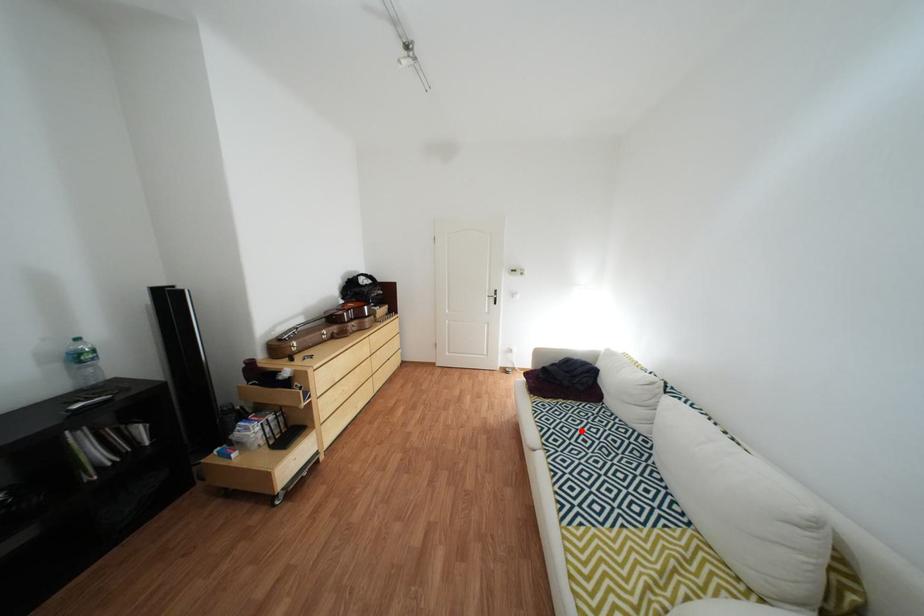
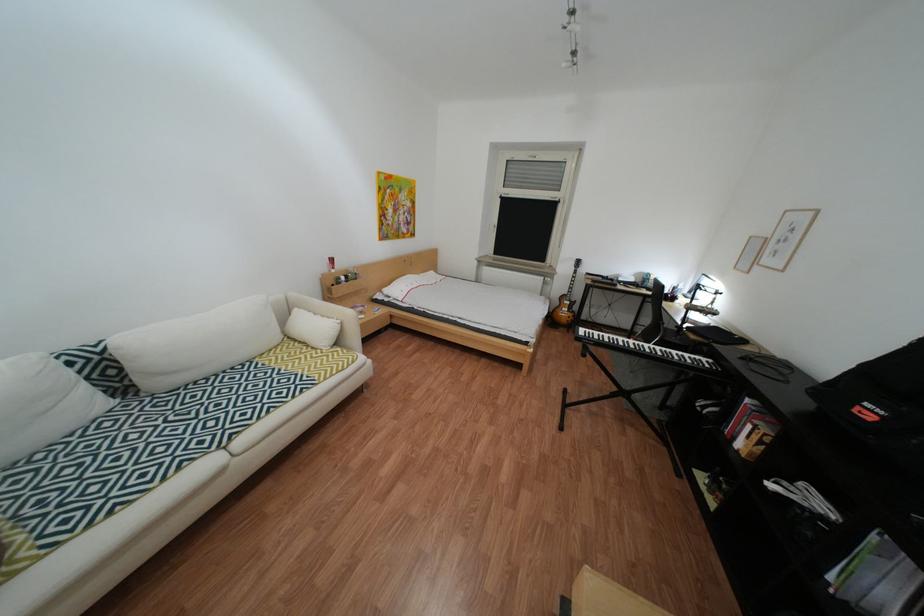
Where in the second image is the point corresponding to the highlighted location from the first image?

(176, 450)